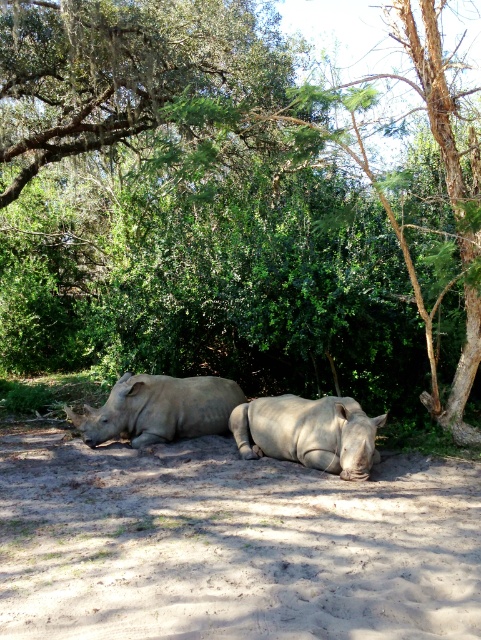
You are a wildlife photographer aiming to capture the smooth gray rhino at center in your shot. You are currently positioned at the point with coordinates (308, 433). Can you confirm if you are standing directly at the rhino?

The smooth gray rhino at center is located at point (308, 433), so yes, you are standing directly at the rhino.

Based on the photo, you are a wildlife photographer aiming to capture a closeup shot of the smooth gray rhino at center. However, there is a gray matte rhinoceros at center blocking your view. Can you adjust your position to take the photo without moving either animal?

The smooth gray rhino at center is positioned under the gray matte rhinoceros at center, so adjusting your position to take the photo without moving either animal may not be possible as the gray matte rhinoceros at center is blocking the view.

You are a wildlife photographer aiming to capture both the smooth gray rhino at center and the gray matte rhinoceros at center in a single frame. Given that your camera has a fixed focal length, which rhino would appear smaller in the photo?

The smooth gray rhino at center would appear smaller in the photo because it has a lesser width compared to the gray matte rhinoceros at center.